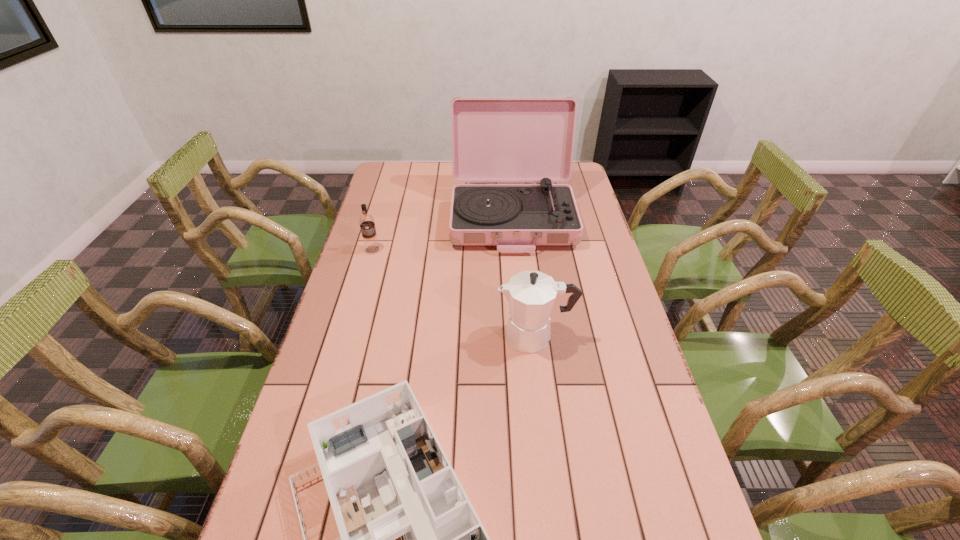
What are the coordinates of `the tallest object` in the screenshot? It's located at 494,139.

Locate an element on the screen. the second tallest object is located at coordinates (531, 294).

Image resolution: width=960 pixels, height=540 pixels. What are the coordinates of `coffeepot` in the screenshot? It's located at (531, 294).

Locate an element on the screen. vodka is located at coordinates (366, 222).

Identify the location of free spot located with the lid open on the tallest object. Image resolution: width=960 pixels, height=540 pixels. (520, 299).

At what (x,y) coordinates should I click in order to perform the action: click on free region located 0.080m at the spout of the second tallest object. Please return your answer as a coordinate pair (x, y). Looking at the image, I should click on point(468,336).

Image resolution: width=960 pixels, height=540 pixels. Identify the location of free space located 0.100m at the spout of the second tallest object. (462, 336).

In order to click on free region located 0.230m at the spout of the second tallest object in this screenshot , I will do `click(417, 336)`.

Identify the location of vacant space located on the label of the third tallest object. The height and width of the screenshot is (540, 960). (349, 330).

Where is `object situated at the far edge`? This screenshot has width=960, height=540. object situated at the far edge is located at coordinates (494, 139).